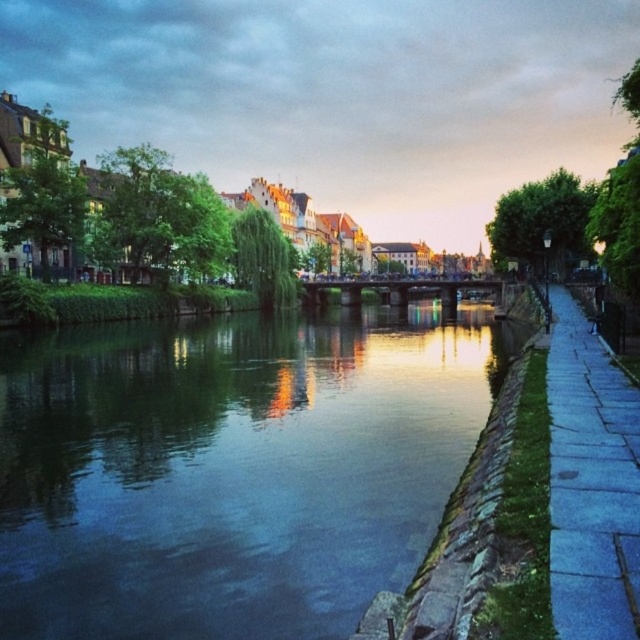
Question: Is green stone river at center thinner than blue stone sidewalk at right?

Choices:
 (A) no
 (B) yes

Answer: (A)

Question: Which point is closer to the camera taking this photo?

Choices:
 (A) (413, 346)
 (B) (554, 444)

Answer: (B)

Question: Does green stone river at center appear on the right side of blue stone sidewalk at right?

Choices:
 (A) no
 (B) yes

Answer: (A)

Question: Can you confirm if green stone river at center is positioned to the left of blue stone sidewalk at right?

Choices:
 (A) no
 (B) yes

Answer: (B)